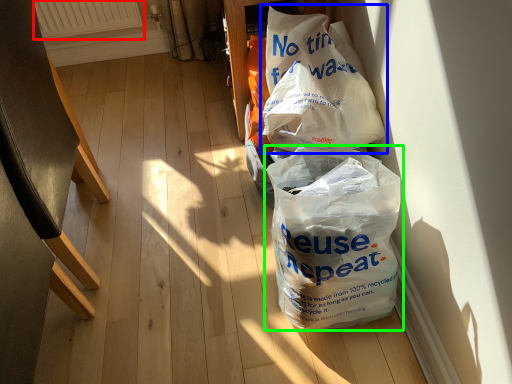
Question: Which object is positioned farthest from radiator (highlighted by a red box)? Select from plastic bag (highlighted by a blue box) and plastic bag (highlighted by a green box).

Choices:
 (A) plastic bag
 (B) plastic bag

Answer: (B)